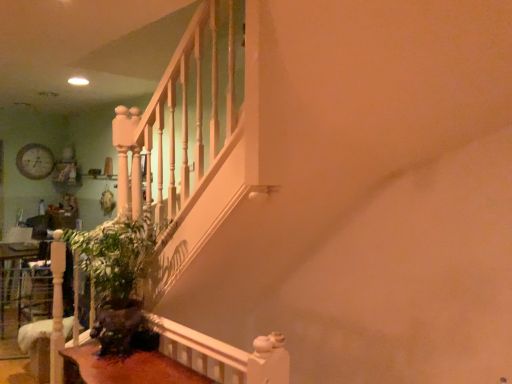
Question: Considering the relative positions of green matte plant at lower left and brown wooden table at lower left in the image provided, is green matte plant at lower left behind brown wooden table at lower left?

Choices:
 (A) yes
 (B) no

Answer: (A)

Question: From a real-world perspective, is green matte plant at lower left below brown wooden table at lower left?

Choices:
 (A) yes
 (B) no

Answer: (B)

Question: Is brown wooden table at lower left at the back of green matte plant at lower left?

Choices:
 (A) yes
 (B) no

Answer: (B)

Question: Could you tell me if green matte plant at lower left is facing brown wooden table at lower left?

Choices:
 (A) yes
 (B) no

Answer: (B)

Question: Does green matte plant at lower left appear on the left side of brown wooden table at lower left?

Choices:
 (A) yes
 (B) no

Answer: (A)

Question: From the image's perspective, is green matte plant at lower left located beneath brown wooden table at lower left?

Choices:
 (A) yes
 (B) no

Answer: (B)

Question: Considering the relative positions of wooden clock at upper left and green matte plant at lower left in the image provided, is wooden clock at upper left to the right of green matte plant at lower left from the viewer's perspective?

Choices:
 (A) yes
 (B) no

Answer: (B)

Question: Is wooden clock at upper left oriented away from green matte plant at lower left?

Choices:
 (A) no
 (B) yes

Answer: (A)

Question: Is wooden clock at upper left far away from green matte plant at lower left?

Choices:
 (A) yes
 (B) no

Answer: (A)

Question: Considering the relative sizes of wooden clock at upper left and green matte plant at lower left in the image provided, is wooden clock at upper left taller than green matte plant at lower left?

Choices:
 (A) yes
 (B) no

Answer: (B)

Question: Is the position of wooden clock at upper left more distant than that of green matte plant at lower left?

Choices:
 (A) yes
 (B) no

Answer: (A)

Question: Does wooden clock at upper left have a greater width compared to green matte plant at lower left?

Choices:
 (A) yes
 (B) no

Answer: (B)

Question: Is wooden clock at upper left smaller than brown wooden table at lower left?

Choices:
 (A) no
 (B) yes

Answer: (B)